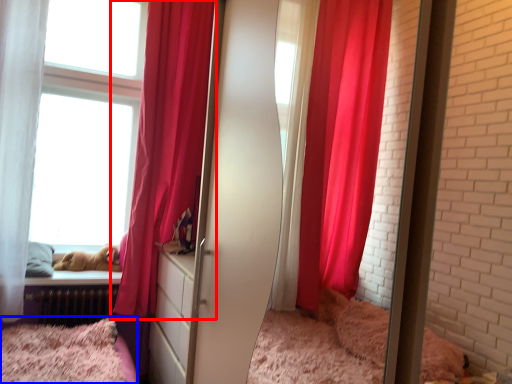
Question: Among these objects, which one is nearest to the camera, curtain (highlighted by a red box) or bed (highlighted by a blue box)?

Choices:
 (A) curtain
 (B) bed

Answer: (B)